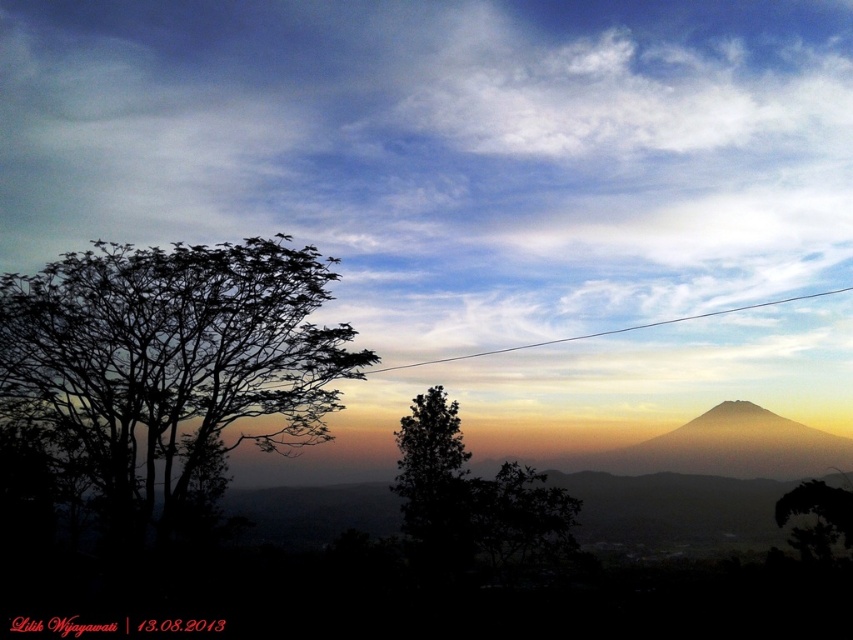
Who is lower down, green matte tree at center or white wire at upper center?

Positioned lower is green matte tree at center.

Does green matte tree at center lie in front of white wire at upper center?

That is True.

The width and height of the screenshot is (853, 640). What do you see at coordinates (432, 472) in the screenshot?
I see `green matte tree at center` at bounding box center [432, 472].

Locate an element on the screen. The height and width of the screenshot is (640, 853). green matte tree at center is located at coordinates (432, 472).

Who is positioned more to the right, smokey yellow mountain at right or green matte tree at lower right?

From the viewer's perspective, smokey yellow mountain at right appears more on the right side.

The image size is (853, 640). What do you see at coordinates (735, 445) in the screenshot? I see `smokey yellow mountain at right` at bounding box center [735, 445].

Locate an element on the screen. This screenshot has width=853, height=640. smokey yellow mountain at right is located at coordinates (735, 445).

Describe the element at coordinates (445, 148) in the screenshot. I see `white fluffy cloud at upper center` at that location.

Can you confirm if white fluffy cloud at upper center is wider than silhouette leafy tree at left?

Indeed, white fluffy cloud at upper center has a greater width compared to silhouette leafy tree at left.

Is point (653, 237) closer to camera compared to point (178, 333)?

No, it is not.

At what (x,y) coordinates should I click in order to perform the action: click on white fluffy cloud at upper center. Please return your answer as a coordinate pair (x, y). Looking at the image, I should click on (445, 148).